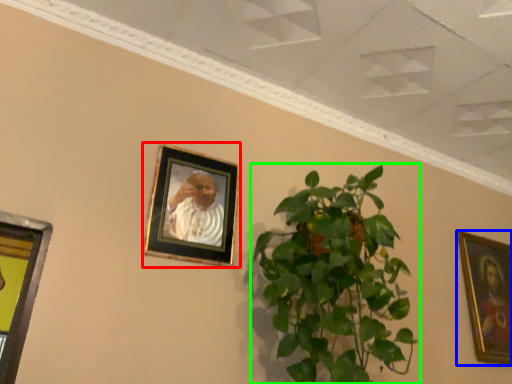
Question: Based on their relative distances, which object is farther from picture frame (highlighted by a red box)? Choose from picture frame (highlighted by a blue box) and houseplant (highlighted by a green box).

Choices:
 (A) picture frame
 (B) houseplant

Answer: (A)